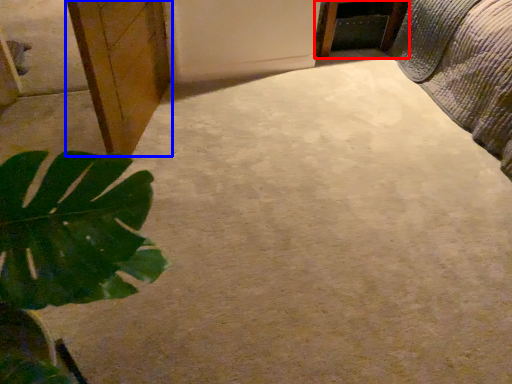
Question: Which of the following is the closest to the observer, furniture (highlighted by a red box) or cabinetry (highlighted by a blue box)?

Choices:
 (A) furniture
 (B) cabinetry

Answer: (B)